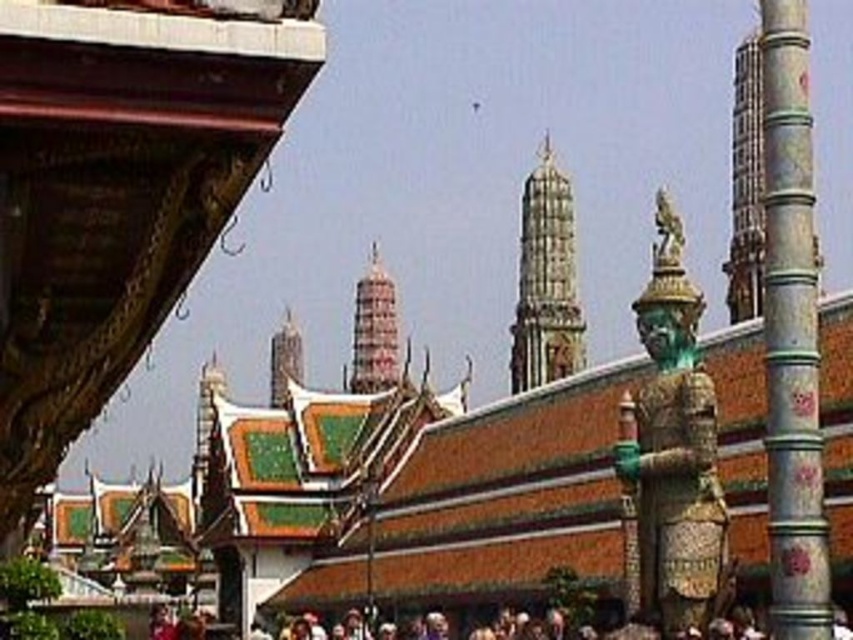
Question: Is carved stone spire at center behind green glazed tile temple at center?

Choices:
 (A) no
 (B) yes

Answer: (B)

Question: Can you confirm if carved stone spire at center is thinner than green glazed tile temple at center?

Choices:
 (A) no
 (B) yes

Answer: (B)

Question: Is silver metallic column at right to the right of carved stone spire at center from the viewer's perspective?

Choices:
 (A) yes
 (B) no

Answer: (A)

Question: Among these objects, which one is nearest to the camera?

Choices:
 (A) silver metallic column at right
 (B) green glazed tile temple at center

Answer: (A)

Question: Which point is closer to the camera?

Choices:
 (A) silver metallic column at right
 (B) green glazed tile temple at center
 (C) reddish-brown stone temple at center
 (D) carved stone spire at center

Answer: (A)

Question: Which object is farther from the camera taking this photo?

Choices:
 (A) green glazed tile temple at center
 (B) reddish-brown stone temple at center
 (C) silver metallic column at right
 (D) carved stone spire at center

Answer: (B)